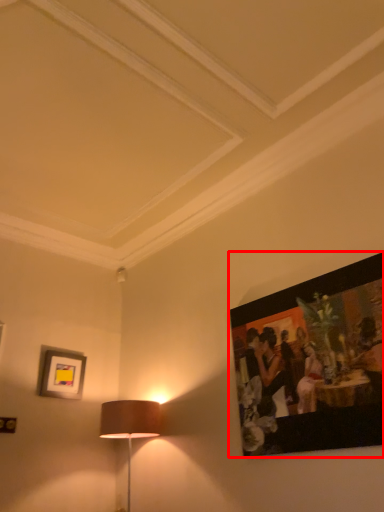
Question: Observing the image, what is the correct spatial positioning of picture frame (annotated by the red box) in reference to picture frame?

Choices:
 (A) left
 (B) right

Answer: (B)